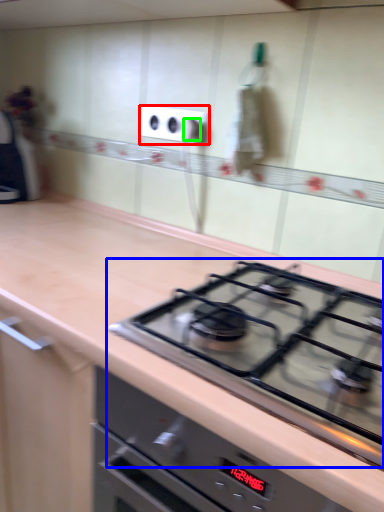
Question: Based on their relative distances, which object is farther from electric outlet (highlighted by a red box)? Choose from gas stove (highlighted by a blue box) and knob (highlighted by a green box).

Choices:
 (A) gas stove
 (B) knob

Answer: (A)